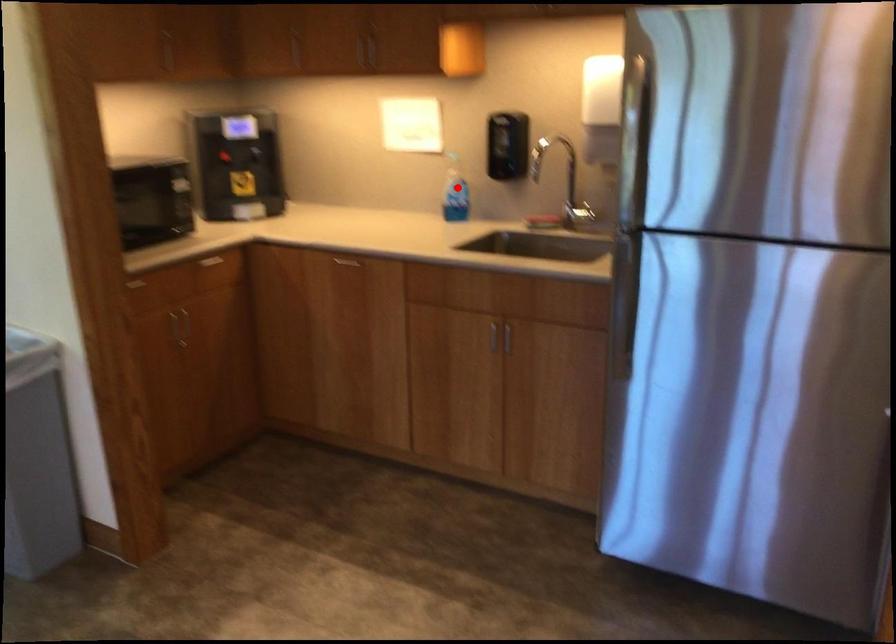
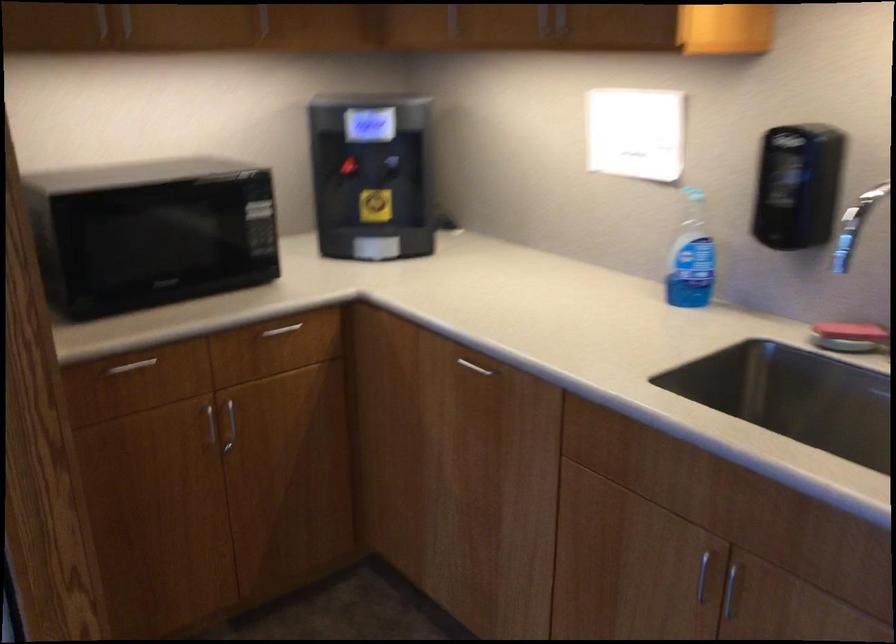
In the second image, find the point that corresponds to the highlighted location in the first image.

(691, 257)